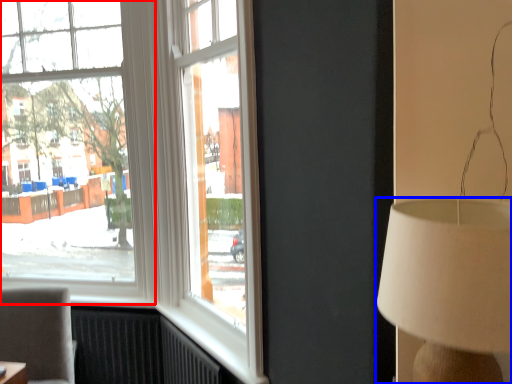
Question: Which of the following is the farthest to the observer, window (highlighted by a red box) or lamp (highlighted by a blue box)?

Choices:
 (A) window
 (B) lamp

Answer: (A)